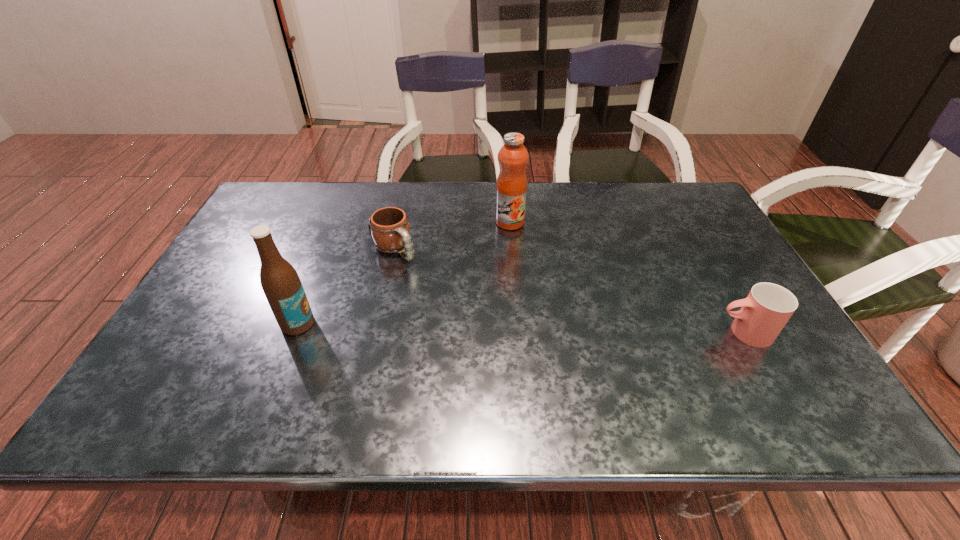
Where is `the leftmost object`? Image resolution: width=960 pixels, height=540 pixels. the leftmost object is located at coordinates (280, 282).

The height and width of the screenshot is (540, 960). Find the location of `the second shortest object`. the second shortest object is located at coordinates (768, 307).

Identify the location of cup. (768, 307).

Find the location of a particular element. This screenshot has height=540, width=960. the second object from right to left is located at coordinates (511, 188).

Image resolution: width=960 pixels, height=540 pixels. I want to click on the farthest object, so click(x=511, y=188).

The height and width of the screenshot is (540, 960). What are the coordinates of `the second farthest object` in the screenshot? It's located at (389, 228).

Where is `the second object from left to right`? This screenshot has width=960, height=540. the second object from left to right is located at coordinates (389, 228).

This screenshot has height=540, width=960. Find the location of `free spot located on the right of the beer bottle`. free spot located on the right of the beer bottle is located at coordinates (465, 323).

Locate an element on the screen. The height and width of the screenshot is (540, 960). vacant area located on the side of the rightmost object with the handle is located at coordinates (677, 332).

What are the coordinates of `vacant position located 0.230m on the side of the rightmost object with the handle` in the screenshot? It's located at (617, 332).